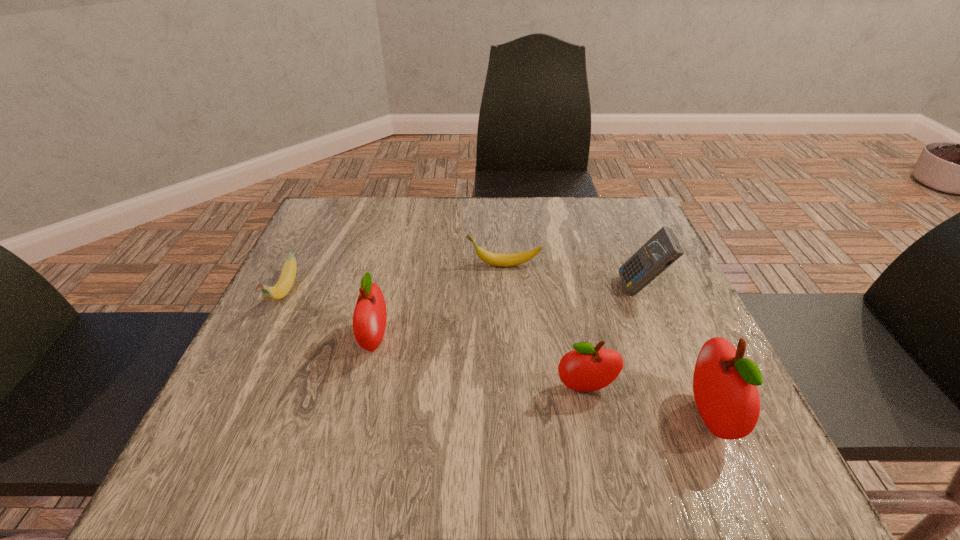
Identify the location of vacant space in between the leftmost object and the calculator. (463, 291).

Where is `free area in between the farthest apple and the calculator`? The width and height of the screenshot is (960, 540). free area in between the farthest apple and the calculator is located at coordinates (508, 314).

You are a GUI agent. You are given a task and a screenshot of the screen. Output one action in this format:
    pyautogui.click(x=<x>, y=<y>)
    Task: Click on the free space between the calculator and the left banana
    This screenshot has width=960, height=540.
    Given the screenshot: What is the action you would take?
    pyautogui.click(x=463, y=291)

Find the location of a particular element. The width and height of the screenshot is (960, 540). vacant area that lies between the left banana and the right banana is located at coordinates (394, 279).

Where is `empty space between the farthest apple and the calculator`? empty space between the farthest apple and the calculator is located at coordinates (508, 314).

This screenshot has width=960, height=540. I want to click on free space between the right banana and the calculator, so click(572, 277).

Identify the location of unoccupied area between the shortest apple and the calculator. (613, 338).

You are a GUI agent. You are given a task and a screenshot of the screen. Output one action in this format:
    pyautogui.click(x=<x>, y=<y>)
    Task: Click on the free spot between the calculator and the leftmost object
    This screenshot has width=960, height=540.
    Given the screenshot: What is the action you would take?
    pyautogui.click(x=463, y=291)

Identify which object is the nearest to the right banana. Please provide its 2D coordinates. Your answer should be formatted as a tuple, i.e. [(x, y)], where the tuple contains the x and y coordinates of a point satisfying the conditions above.

[(663, 249)]

This screenshot has height=540, width=960. I want to click on the second closest object to the left banana, so click(x=503, y=260).